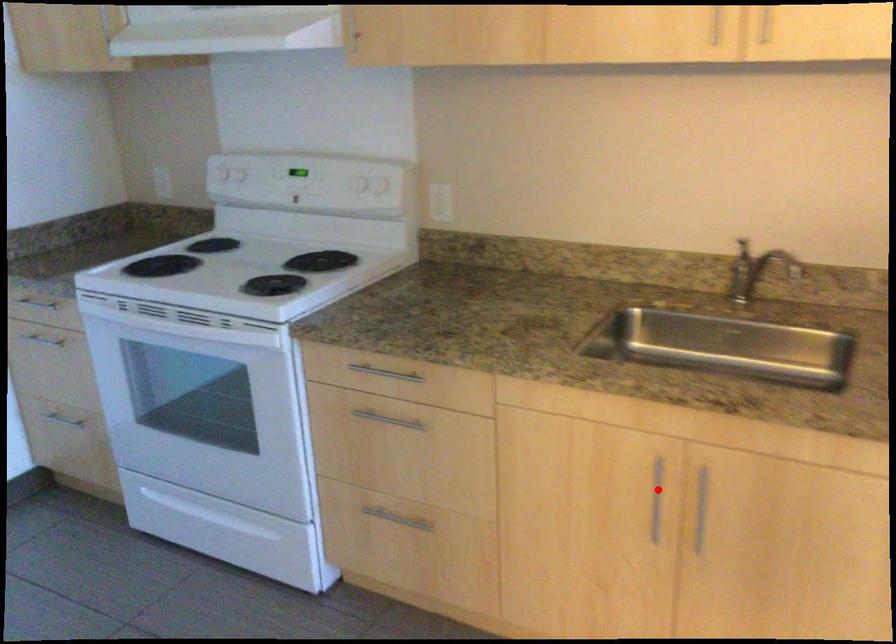
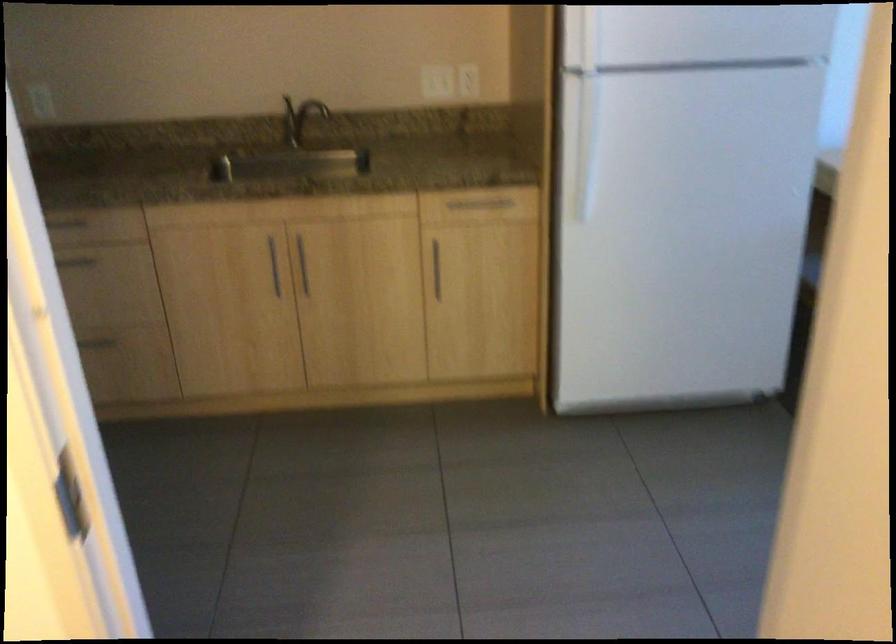
In the second image, find the point that corresponds to the highlighted location in the first image.

(273, 265)